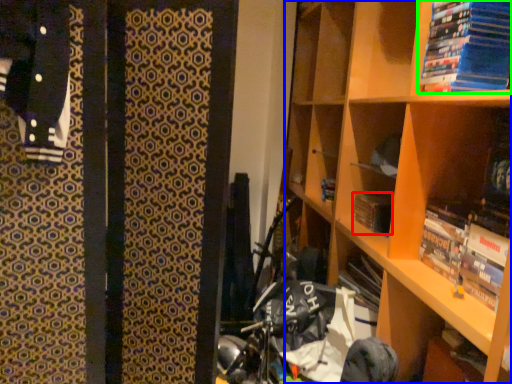
Question: Which object is positioned closest to paperback book (highlighted by a red box)? Select from shelf (highlighted by a blue box) and book (highlighted by a green box).

Choices:
 (A) shelf
 (B) book

Answer: (A)